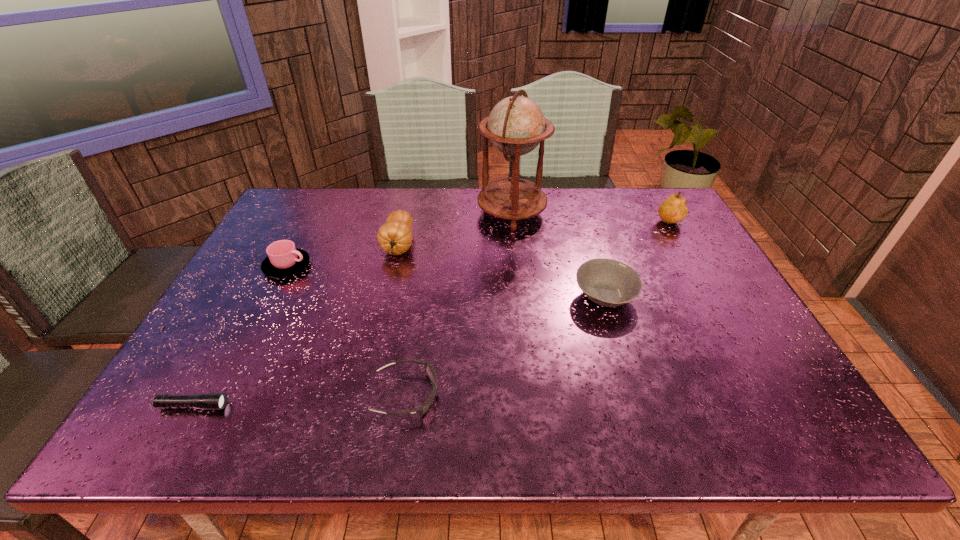
The height and width of the screenshot is (540, 960). Find the location of `the third object from right to left`. the third object from right to left is located at coordinates (516, 125).

The height and width of the screenshot is (540, 960). Identify the location of the tallest object. (516, 125).

Find the location of `the rightmost object`. the rightmost object is located at coordinates (673, 210).

The width and height of the screenshot is (960, 540). I want to click on gourd, so click(x=395, y=237).

The height and width of the screenshot is (540, 960). Find the location of `cup`. cup is located at coordinates (284, 259).

You are a GUI agent. You are given a task and a screenshot of the screen. Output one action in this format:
    pyautogui.click(x=<x>, y=<y>)
    Task: Click on the second object from right to left
    
    Given the screenshot: What is the action you would take?
    pyautogui.click(x=609, y=283)

Locate an element on the screen. Image resolution: width=960 pixels, height=540 pixels. the sixth tallest object is located at coordinates (429, 369).

This screenshot has width=960, height=540. I want to click on flashlight, so click(210, 401).

At what (x,y) coordinates should I click in order to perform the action: click on free spot located 0.320m on the surface of the globe. Please return your answer as a coordinate pair (x, y). This screenshot has width=960, height=540. Looking at the image, I should click on (379, 212).

This screenshot has height=540, width=960. Identify the location of vacant area situated 0.080m on the surface of the globe. (453, 212).